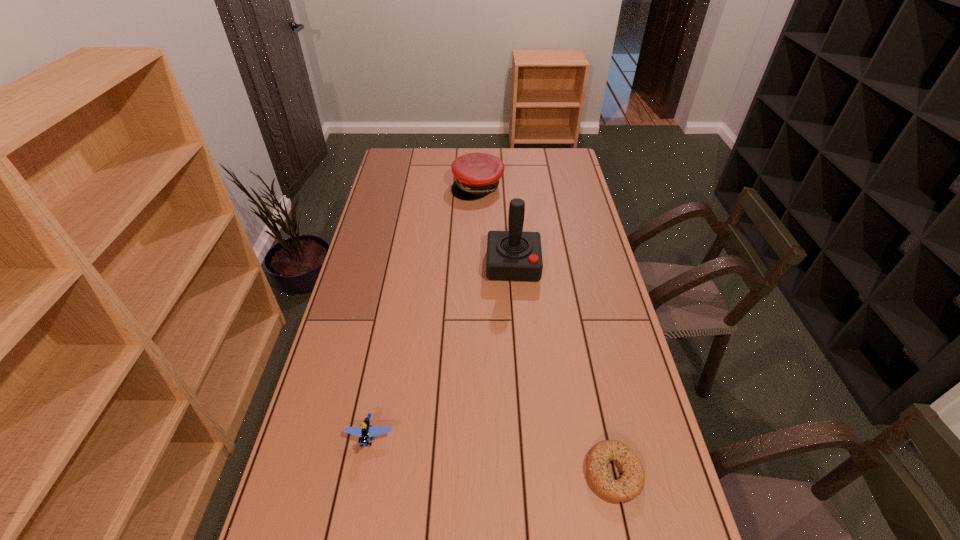
Image resolution: width=960 pixels, height=540 pixels. I want to click on vacant region located at the front of the second tallest object where the visor is located, so pos(485,228).

You are a GUI agent. You are given a task and a screenshot of the screen. Output one action in this format:
    pyautogui.click(x=<x>, y=<y>)
    Task: Click on the free space located at the front of the second tallest object where the visor is located
    The image size is (960, 540).
    Given the screenshot: What is the action you would take?
    pyautogui.click(x=484, y=223)

At what (x,y) coordinates should I click in order to perform the action: click on free spot located 0.360m at the front of the second tallest object where the visor is located. Please return your answer as a coordinate pair (x, y). Looking at the image, I should click on (490, 255).

Where is `vacant space positioned 0.370m on the base of the second farthest object`? The width and height of the screenshot is (960, 540). vacant space positioned 0.370m on the base of the second farthest object is located at coordinates (515, 373).

In order to click on free space located on the base of the second farthest object in this screenshot , I will do `click(514, 301)`.

Find the location of `vacant space located 0.210m on the base of the second farthest object`. vacant space located 0.210m on the base of the second farthest object is located at coordinates (515, 330).

Locate an element on the screen. Image resolution: width=960 pixels, height=540 pixels. object at the far edge is located at coordinates (477, 174).

Identify the location of object that is at the near edge. The image size is (960, 540). (631, 483).

Locate an element on the screen. This screenshot has width=960, height=540. object positioned at the left edge is located at coordinates (366, 431).

Where is `object present at the right edge`? object present at the right edge is located at coordinates (631, 483).